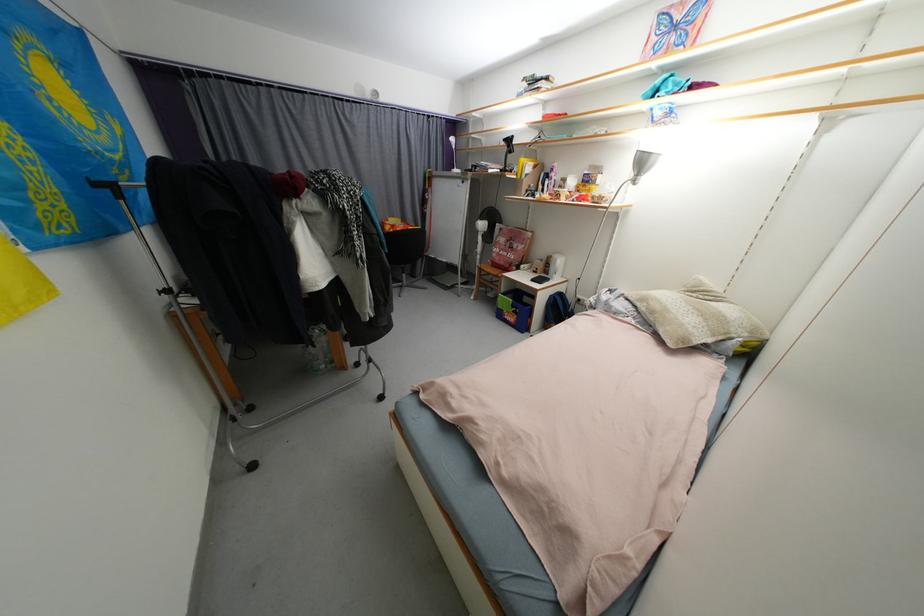
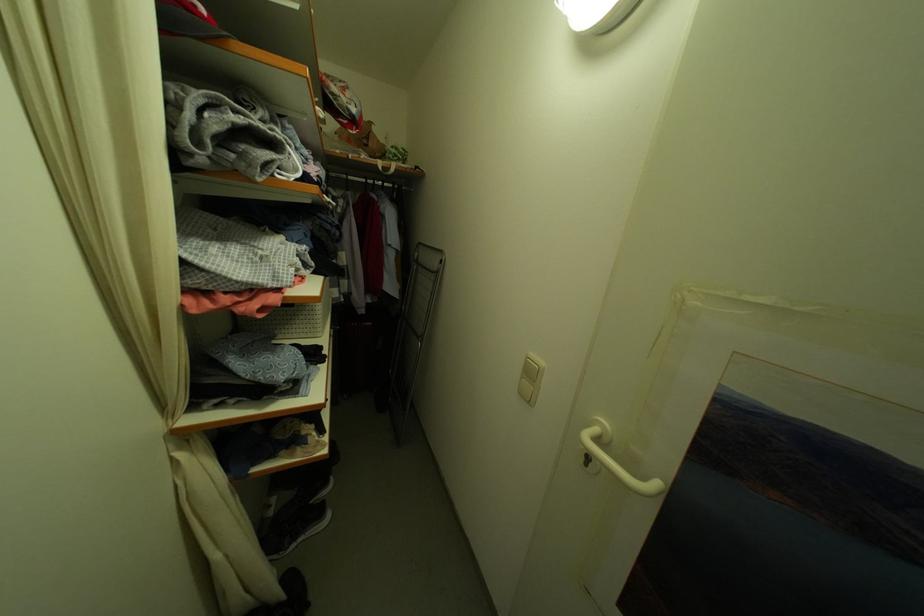
Question: The first image is from the beginning of the video and the second image is from the end. How did the camera likely rotate when shooting the video?

Choices:
 (A) Left
 (B) Right
 (C) Up
 (D) Down

Answer: (B)